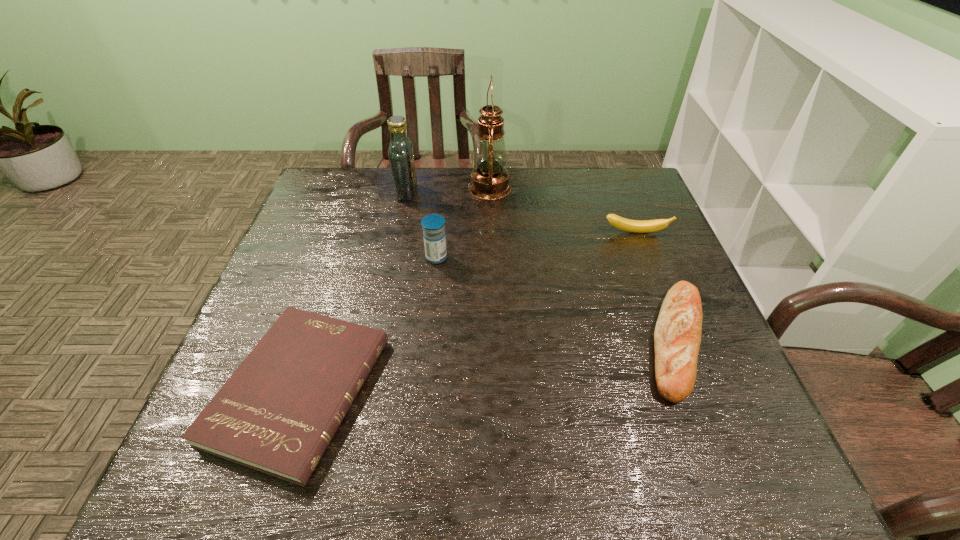
The width and height of the screenshot is (960, 540). In order to click on oil lamp in this screenshot , I will do `click(489, 179)`.

Identify the location of the third object from right to left. This screenshot has width=960, height=540. (489, 179).

Where is `the second tallest object`? This screenshot has width=960, height=540. the second tallest object is located at coordinates (400, 153).

You are a GUI agent. You are given a task and a screenshot of the screen. Output one action in this format:
    pyautogui.click(x=<x>, y=<y>)
    Task: Click on the medicine
    The height and width of the screenshot is (540, 960).
    Given the screenshot: What is the action you would take?
    pyautogui.click(x=434, y=235)

The width and height of the screenshot is (960, 540). What are the coordinates of `the fourth shortest object` in the screenshot? It's located at (434, 235).

The width and height of the screenshot is (960, 540). Identify the location of the fourth nearest object. (638, 226).

Locate an element on the screen. baguet is located at coordinates (677, 336).

Image resolution: width=960 pixels, height=540 pixels. Identify the location of hardback book. (277, 413).

The image size is (960, 540). I want to click on free space located 0.050m on the front of the oil lamp, so click(491, 213).

In order to click on vacant area situated on the front-facing side of the second tallest object in this screenshot , I will do `click(534, 192)`.